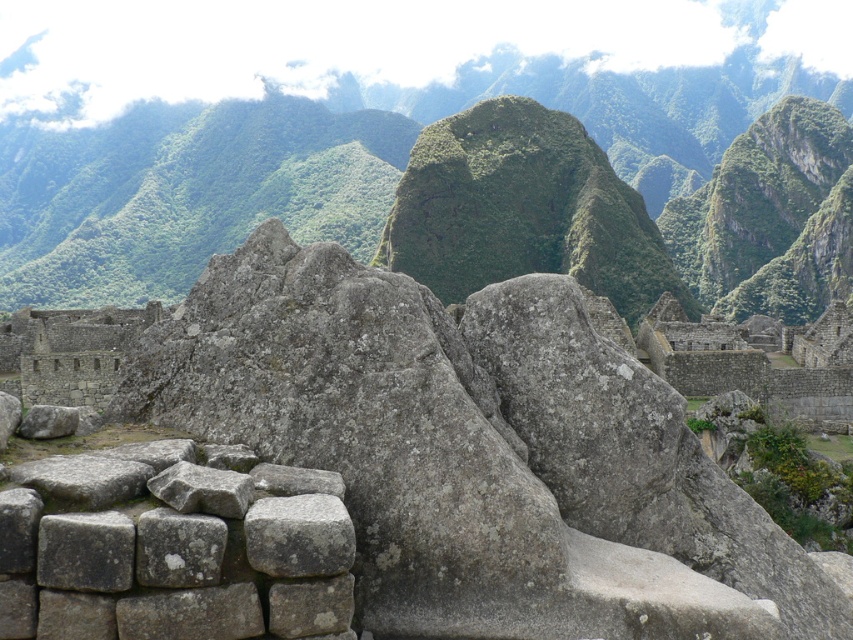
Looking at this image, you are an archaeologist examining the ancient site. You notice the gray stone wall at center and the green rock formation at center. Which object is located to the right of the other?

The gray stone wall at center is positioned on the right side of green rock formation at center.

You are standing at the origin point of the coordinate system in the image. Where is the gray stone wall at center located?

The gray stone wall at center is located at coordinate point 0.703 in the x axis and 0.550 in the y axis.